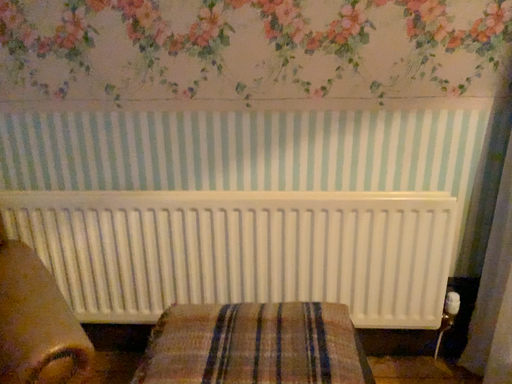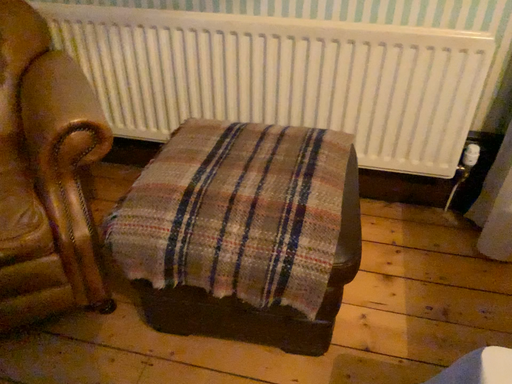
Question: How did the camera likely rotate when shooting the video?

Choices:
 (A) rotated right
 (B) rotated left

Answer: (B)